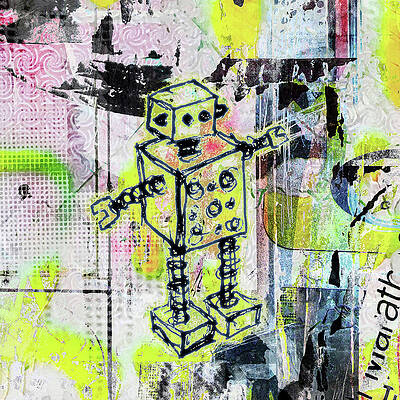
At what (x,y) coordinates should I click in order to perform the action: click on painting. Please return your answer as a coordinate pair (x, y). This screenshot has width=400, height=400. Looking at the image, I should click on (121, 135).